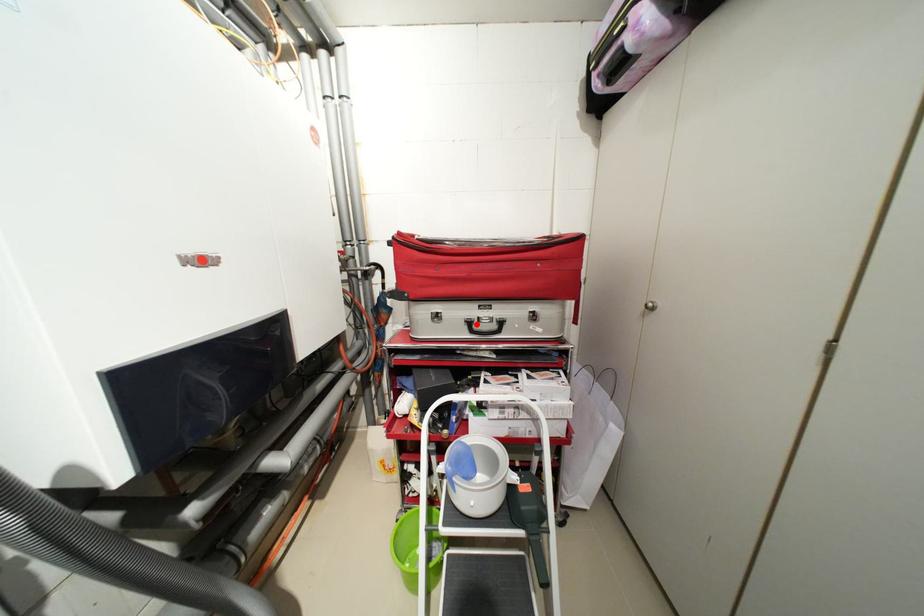
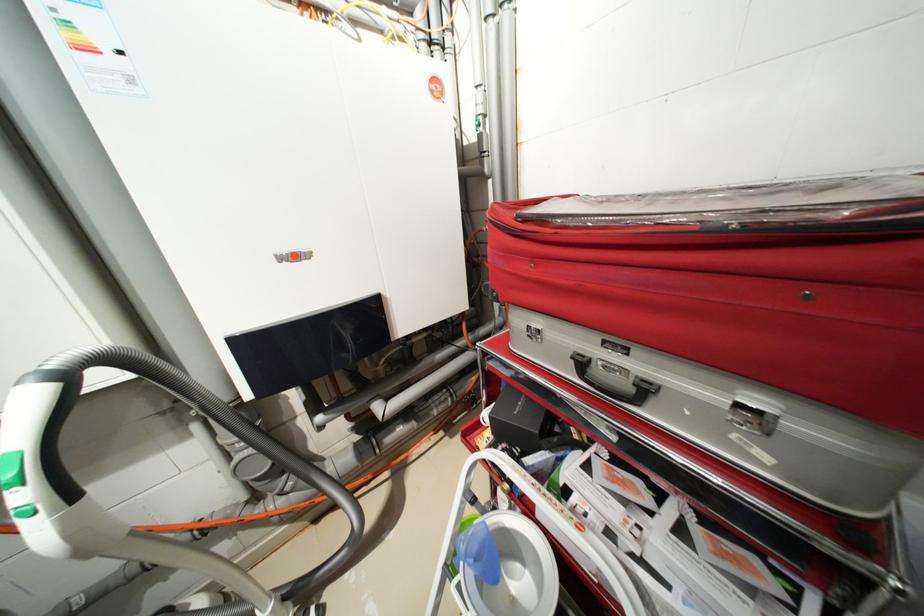
Locate, in the second image, the point that corresponds to the highlighted location in the first image.

(589, 363)